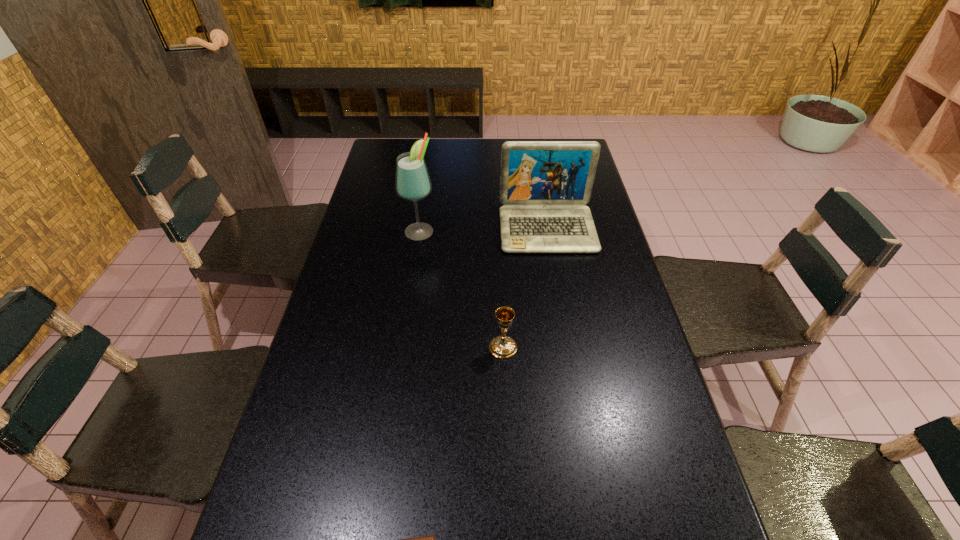
At what (x,y) coordinates should I click in order to perform the action: click on the tallest object. Please return your answer as a coordinate pair (x, y). Looking at the image, I should click on (412, 182).

In order to click on laptop computer in this screenshot , I will do `click(544, 185)`.

Identify the location of the second shortest object. (503, 346).

Locate an element on the screen. the third farthest object is located at coordinates (503, 346).

Locate an element on the screen. The width and height of the screenshot is (960, 540). free space located 0.390m on the right of the tallest object is located at coordinates (x=553, y=230).

Locate an element on the screen. The image size is (960, 540). free space located on the screen of the laptop computer is located at coordinates (559, 296).

I want to click on free space located 0.400m on the front of the chalice, so click(512, 534).

At what (x,y) coordinates should I click in order to perform the action: click on object located at the right edge. Please return your answer as a coordinate pair (x, y). Looking at the image, I should click on (544, 185).

Find the location of a particular element. vacant point at the left edge is located at coordinates (392, 242).

Locate an element on the screen. Image resolution: width=960 pixels, height=540 pixels. free space at the right edge of the desktop is located at coordinates (598, 296).